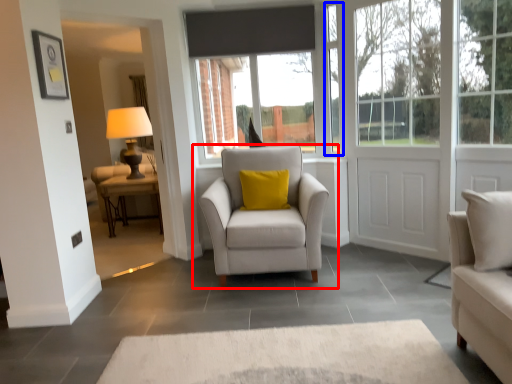
Question: Which of the following is the farthest to the observer, chair (highlighted by a red box) or window frame (highlighted by a blue box)?

Choices:
 (A) chair
 (B) window frame

Answer: (B)